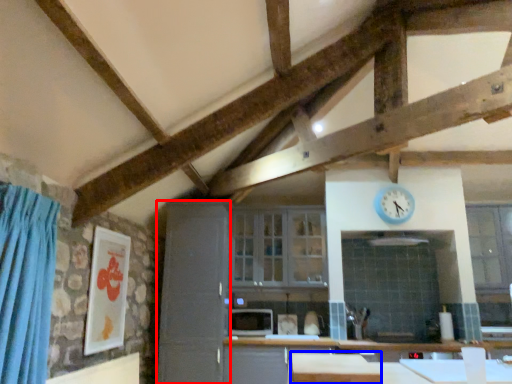
Question: Which object appears farthest to the camera in this image, cabinetry (highlighted by a red box) or table (highlighted by a blue box)?

Choices:
 (A) cabinetry
 (B) table

Answer: (A)